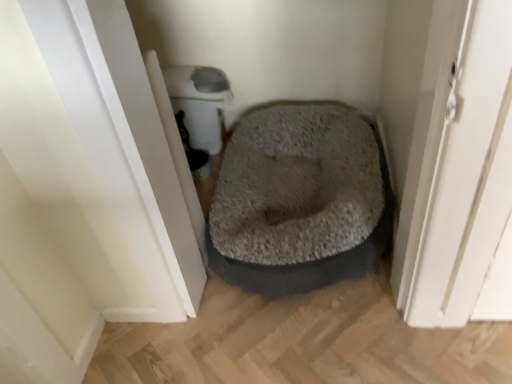
Question: Considering the positions of gray plush dog bed at center and white glossy screen door at left in the image, is gray plush dog bed at center wider or thinner than white glossy screen door at left?

Choices:
 (A) wide
 (B) thin

Answer: (A)

Question: In terms of height, does gray plush dog bed at center look taller or shorter compared to white glossy screen door at left?

Choices:
 (A) tall
 (B) short

Answer: (B)

Question: Which is correct: gray plush dog bed at center is inside white glossy screen door at left, or outside of it?

Choices:
 (A) inside
 (B) outside

Answer: (B)

Question: From a real-world perspective, relative to gray plush dog bed at center, is white glossy screen door at left vertically above or below?

Choices:
 (A) above
 (B) below

Answer: (A)

Question: Considering the positions of white glossy screen door at left and gray plush dog bed at center in the image, is white glossy screen door at left taller or shorter than gray plush dog bed at center?

Choices:
 (A) tall
 (B) short

Answer: (A)

Question: Would you say white glossy screen door at left is to the left or to the right of gray plush dog bed at center in the picture?

Choices:
 (A) left
 (B) right

Answer: (A)

Question: Based on their sizes in the image, would you say white glossy screen door at left is bigger or smaller than gray plush dog bed at center?

Choices:
 (A) small
 (B) big

Answer: (A)